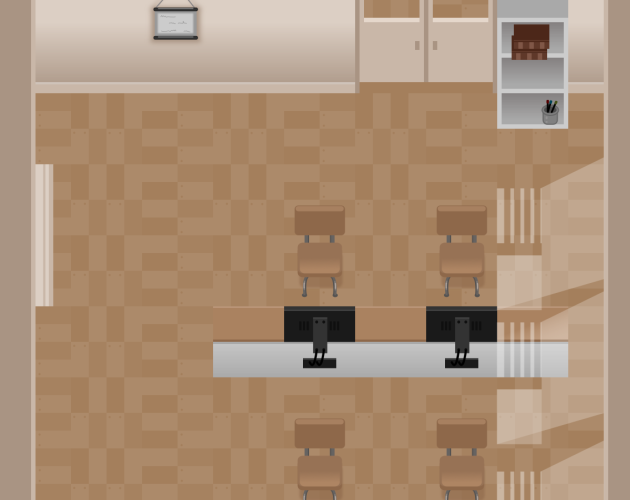
Locate an element on the screen. This screenshot has height=500, width=630. doors is located at coordinates (394, 42), (455, 41).